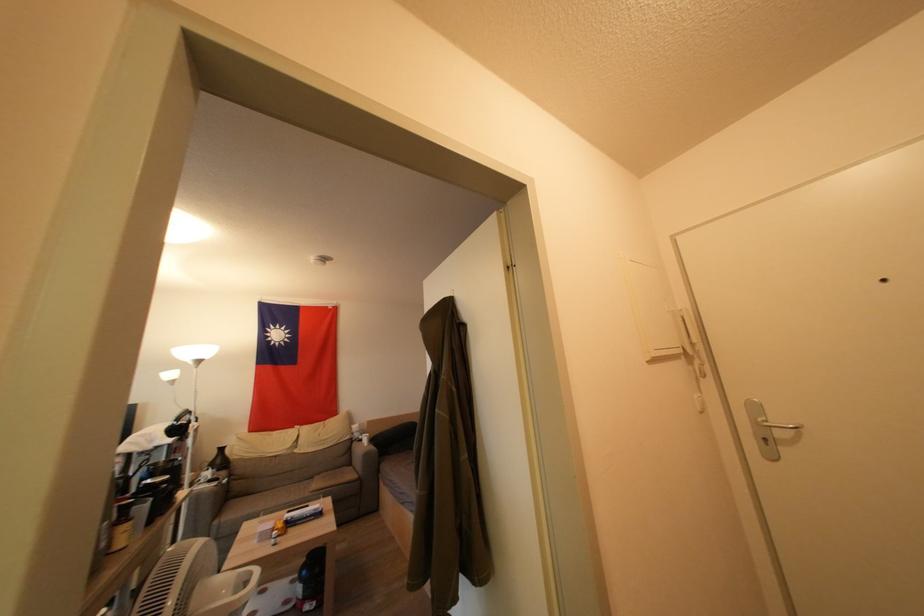
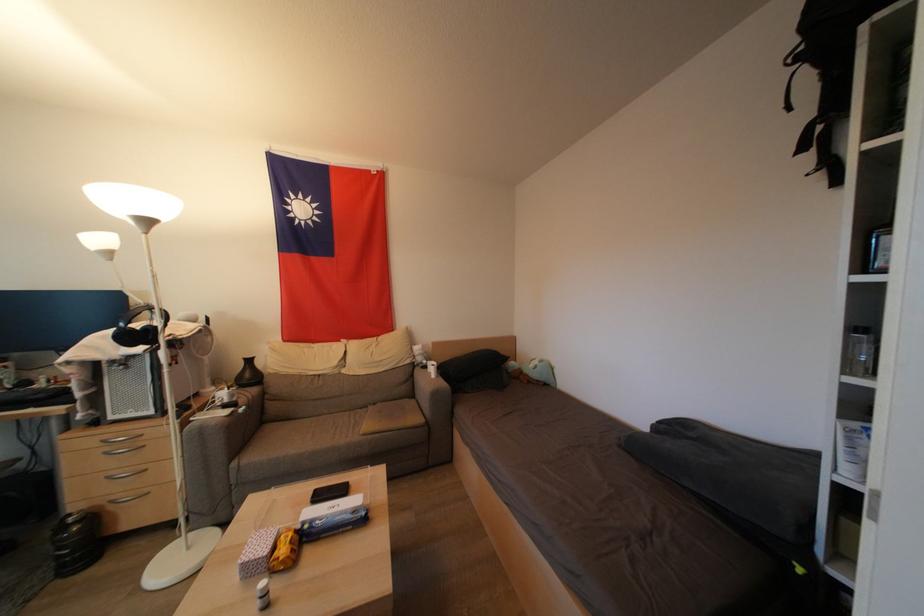
The point at (365,444) is marked in the first image. Where is the corresponding point in the second image?

(430, 371)